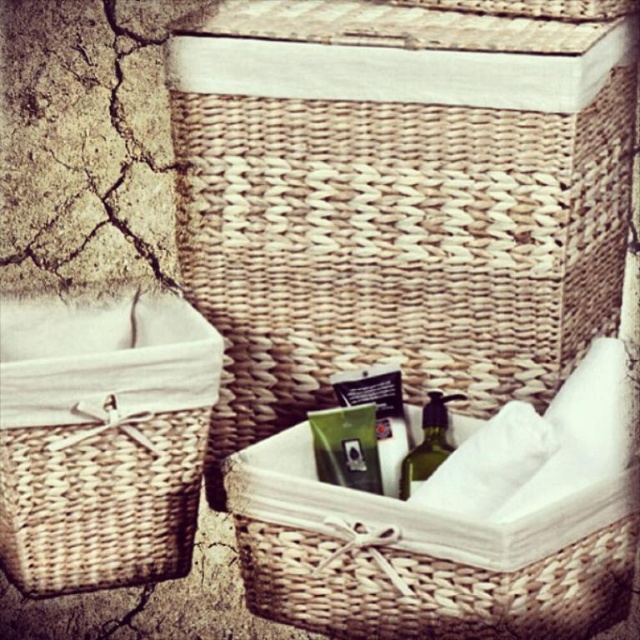
Question: Which point is farther to the camera?

Choices:
 (A) green matte toiletry at center
 (B) woven beige basket at center
 (C) matte green plastic card at center

Answer: (A)

Question: Can you confirm if natural woven picnic basket at left is thinner than green matte toiletry at center?

Choices:
 (A) yes
 (B) no

Answer: (B)

Question: Which of the following is the farthest from the observer?

Choices:
 (A) woven natural picnic basket at upper center
 (B) green matte toiletry at center
 (C) matte green plastic card at center

Answer: (B)

Question: Does woven natural picnic basket at upper center lie behind green matte toiletry at center?

Choices:
 (A) yes
 (B) no

Answer: (B)

Question: In this image, where is woven beige basket at center located relative to matte green plastic card at center?

Choices:
 (A) above
 (B) below

Answer: (B)

Question: Which point is farther from the camera taking this photo?

Choices:
 (A) (369, 449)
 (B) (426, 404)
 (C) (260, 520)

Answer: (B)